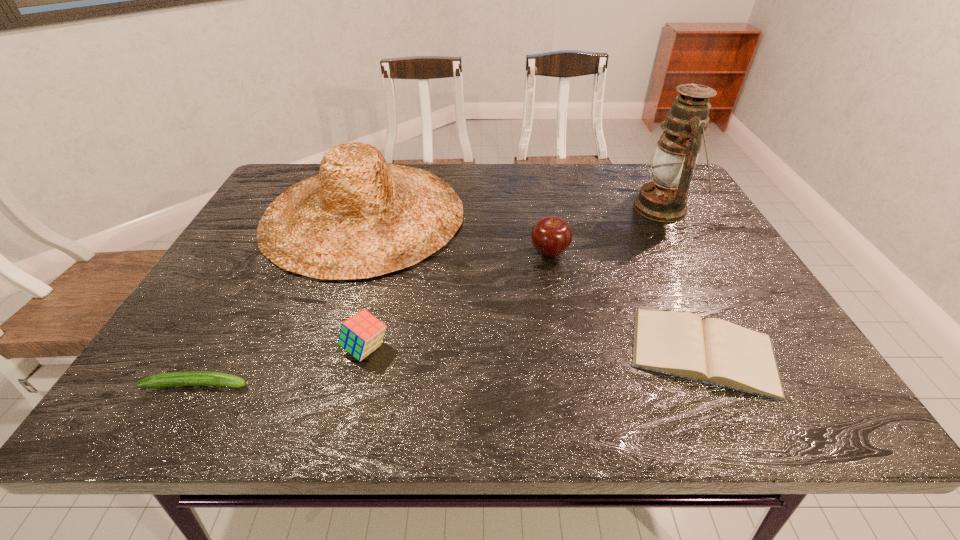
Select which object is the second closest to the sunhat. Please provide its 2D coordinates. Your answer should be formatted as a tuple, i.e. [(x, y)], where the tuple contains the x and y coordinates of a point satisfying the conditions above.

[(551, 236)]

Locate which object ranks fifth in proximity to the third tallest object. Please provide its 2D coordinates. Your answer should be formatted as a tuple, i.e. [(x, y)], where the tuple contains the x and y coordinates of a point satisfying the conditions above.

[(188, 378)]

Where is `free region that satisfies the following two spatial constraints: 1. on the front side of the second tallest object; 2. on the front-facing side of the zucchini`? The width and height of the screenshot is (960, 540). free region that satisfies the following two spatial constraints: 1. on the front side of the second tallest object; 2. on the front-facing side of the zucchini is located at coordinates (305, 384).

The width and height of the screenshot is (960, 540). Find the location of `vacant position in the image that satisfies the following two spatial constraints: 1. on the front side of the fourth tallest object; 2. on the left side of the fifth shortest object`. vacant position in the image that satisfies the following two spatial constraints: 1. on the front side of the fourth tallest object; 2. on the left side of the fifth shortest object is located at coordinates (318, 349).